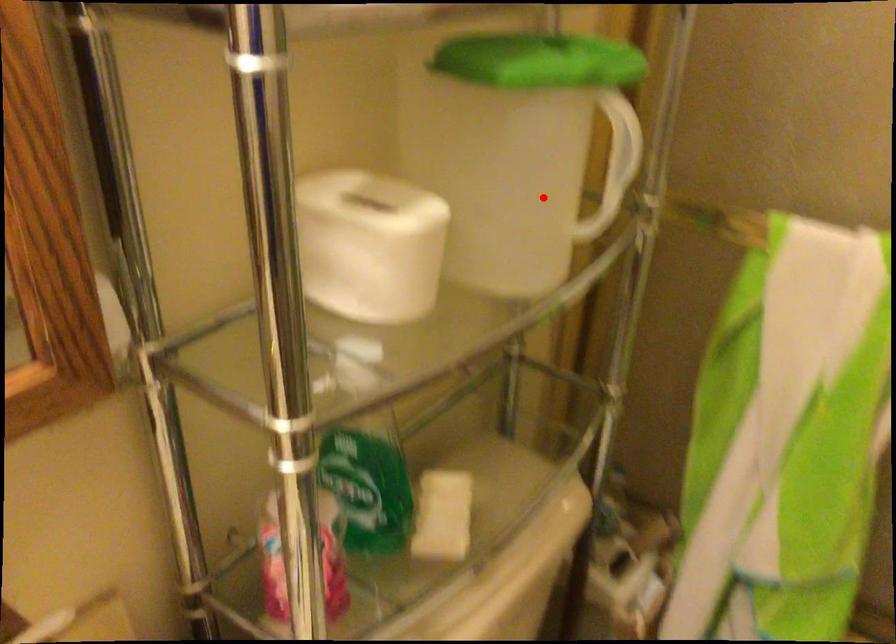
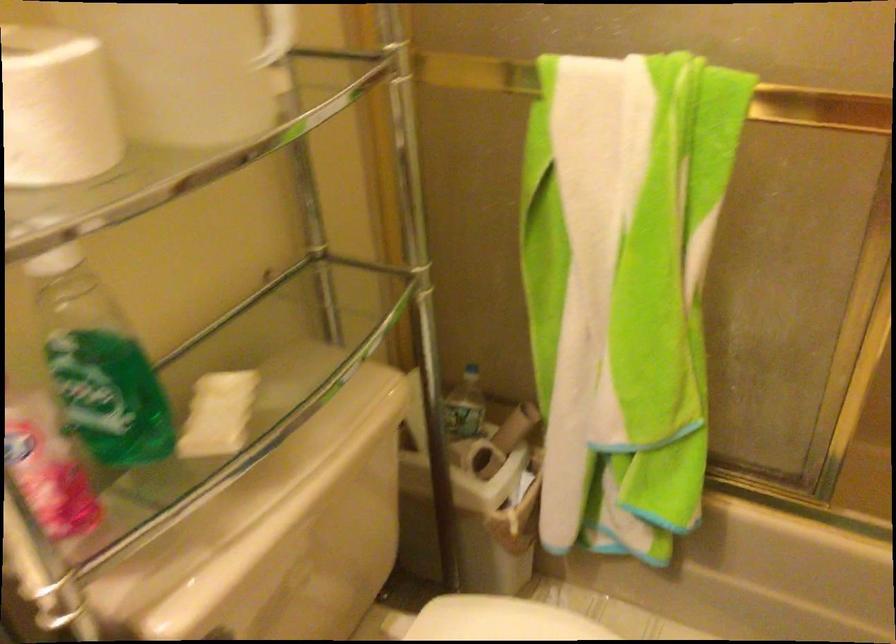
Find the pixel in the second image that matches the highlighted location in the first image.

(270, 64)